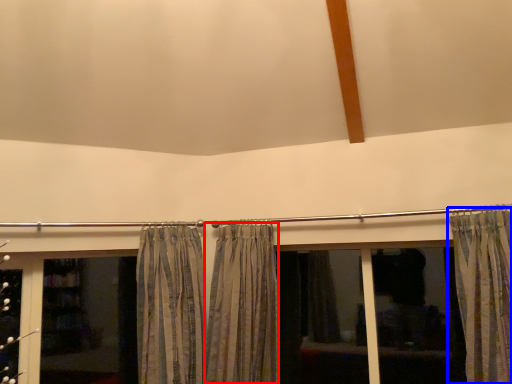
Question: Among these objects, which one is nearest to the camera, curtain (highlighted by a red box) or curtain (highlighted by a blue box)?

Choices:
 (A) curtain
 (B) curtain

Answer: (B)